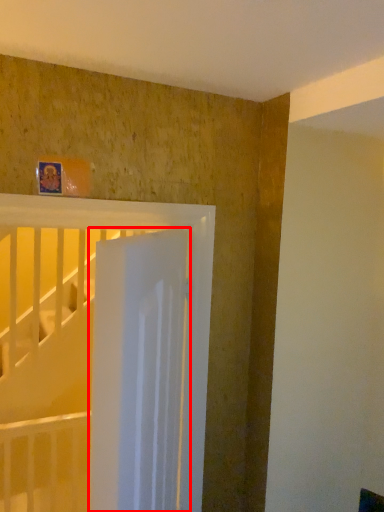
Question: In this image, where is door (annotated by the red box) located relative to bed?

Choices:
 (A) left
 (B) right

Answer: (B)